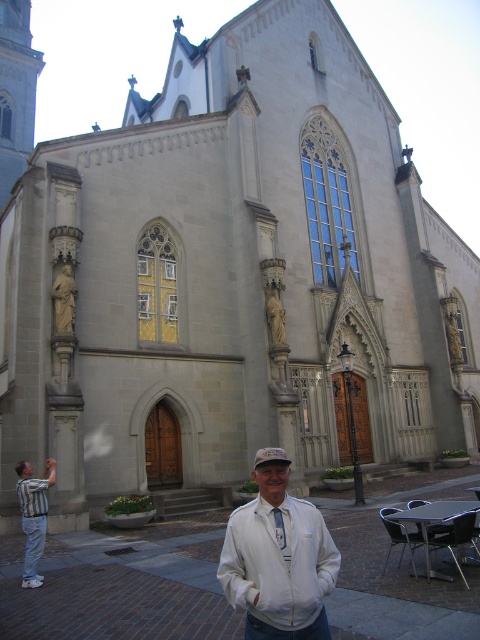
Can you confirm if white matte jacket at center is positioned above striped fabric shirt at lower left?

No, white matte jacket at center is not above striped fabric shirt at lower left.

At what (x,y) coordinates should I click in order to perform the action: click on white matte jacket at center. Please return your answer as a coordinate pair (x, y). The width and height of the screenshot is (480, 640). Looking at the image, I should click on (277, 557).

Which is in front, point (228, 600) or point (24, 573)?

Point (228, 600)

Can you confirm if white matte jacket at center is thinner than striped cotton shirt at lower left?

Correct, white matte jacket at center's width is less than striped cotton shirt at lower left's.

Who is more distant from viewer, (273, 592) or (28, 545)?

The point (28, 545) is behind.

Where is `white matte jacket at center`? This screenshot has height=640, width=480. white matte jacket at center is located at coordinates (277, 557).

Does striped cotton shirt at lower left have a greater height compared to striped fabric shirt at lower left?

Yes, striped cotton shirt at lower left is taller than striped fabric shirt at lower left.

How far apart are striped cotton shirt at lower left and striped fabric shirt at lower left?

striped cotton shirt at lower left and striped fabric shirt at lower left are 9.73 feet apart.

What are the coordinates of `striped cotton shirt at lower left` in the screenshot? It's located at (34, 515).